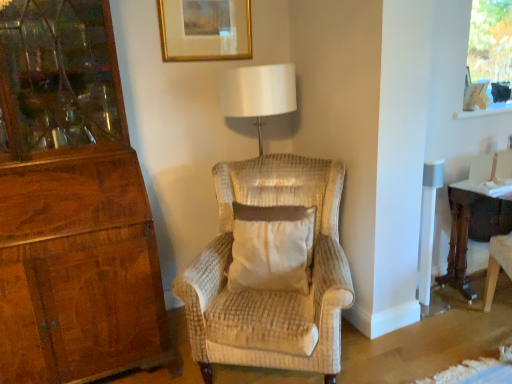
Question: Visually, is transparent glass window screen at upper right positioned to the left or to the right of dark brown wood desk at right?

Choices:
 (A) left
 (B) right

Answer: (B)

Question: In terms of width, does transparent glass window screen at upper right look wider or thinner when compared to dark brown wood desk at right?

Choices:
 (A) thin
 (B) wide

Answer: (A)

Question: Which object is the farthest from the transparent glass window screen at upper right?

Choices:
 (A) dark brown wood desk at right
 (B) white textured pillow at center
 (C) gold-framed picture at upper center

Answer: (B)

Question: Which of these objects is positioned farthest from the white textured pillow at center?

Choices:
 (A) transparent glass window screen at upper right
 (B) gold-framed picture at upper center
 (C) dark brown wood desk at right

Answer: (A)